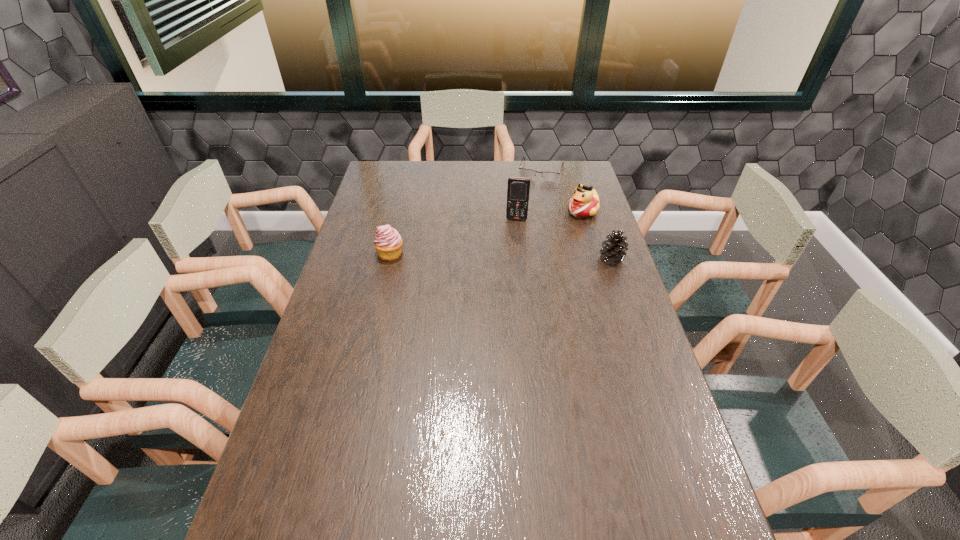
Identify the location of free space between the cellular telephone and the leftmost object. (453, 237).

I want to click on free area in between the cupcake and the tallest object, so pyautogui.click(x=453, y=237).

The image size is (960, 540). I want to click on free space between the cupcake and the farthest object, so click(466, 212).

Image resolution: width=960 pixels, height=540 pixels. I want to click on free spot between the cupcake and the cellular telephone, so click(x=453, y=237).

Locate an element on the screen. The height and width of the screenshot is (540, 960). vacant point located between the tallest object and the pinecone is located at coordinates (564, 239).

In order to click on vacant point located between the pinecone and the cellular telephone in this screenshot , I will do `click(564, 239)`.

The width and height of the screenshot is (960, 540). In order to click on object that stands as the third closest to the leftmost object in this screenshot , I will do `click(585, 202)`.

Where is `object that stands as the fourth closest to the pinecone`? This screenshot has width=960, height=540. object that stands as the fourth closest to the pinecone is located at coordinates (388, 243).

Where is `vacant space that satisfies the following two spatial constraints: 1. on the front side of the pinecone; 2. on the right side of the duck`? This screenshot has width=960, height=540. vacant space that satisfies the following two spatial constraints: 1. on the front side of the pinecone; 2. on the right side of the duck is located at coordinates (597, 259).

At what (x,y) coordinates should I click in order to perform the action: click on vacant region that satisfies the following two spatial constraints: 1. on the front side of the pinecone; 2. on the right side of the farthest object. Please return your answer as a coordinate pair (x, y). The image size is (960, 540). Looking at the image, I should click on (559, 259).